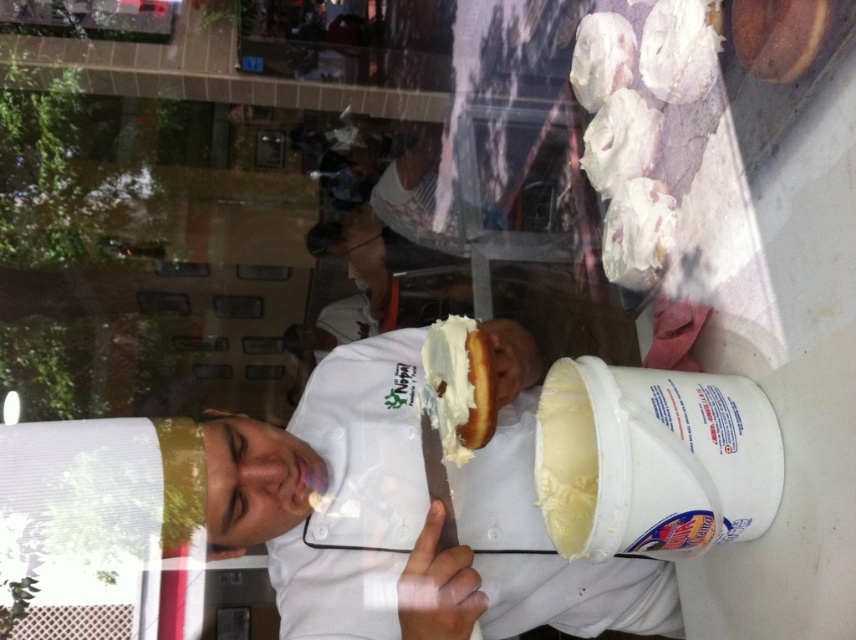
You are a baker who wants to place both the white fluffy pastry at upper right and the brown matte donut at upper right on a shelf that can only hold items up to 10 inches wide. Can you fit both items on the shelf if they are placed side by side?

The white fluffy pastry at upper right is wider than the brown matte donut at upper right. However, without knowing their exact widths, it is impossible to determine if their combined width exceeds the shelf capacity. Please measure both items to confirm.

You are a customer in the bakery and want to order the white creamy pastry at upper right. The bakery uses a coordinate system where the top left corner is the origin. Which direction should you look to find it?

The white creamy pastry at upper right is located at point coordinates with x 0.366 and y 0.745. Since the top left corner is the origin, the x value increases to the right and the y value increases downward. Therefore, the pastry is positioned to the right and slightly below the top left corner. To locate it, you should look towards the upper right area of the display case.

Looking at the scene in the bakery, you notice two items at the upper right corner of the image. Which one is positioned to the left between the white fluffy pastry at upper right and the brown matte donut at upper right?

The white fluffy pastry at upper right is positioned to the left of the brown matte donut at upper right.